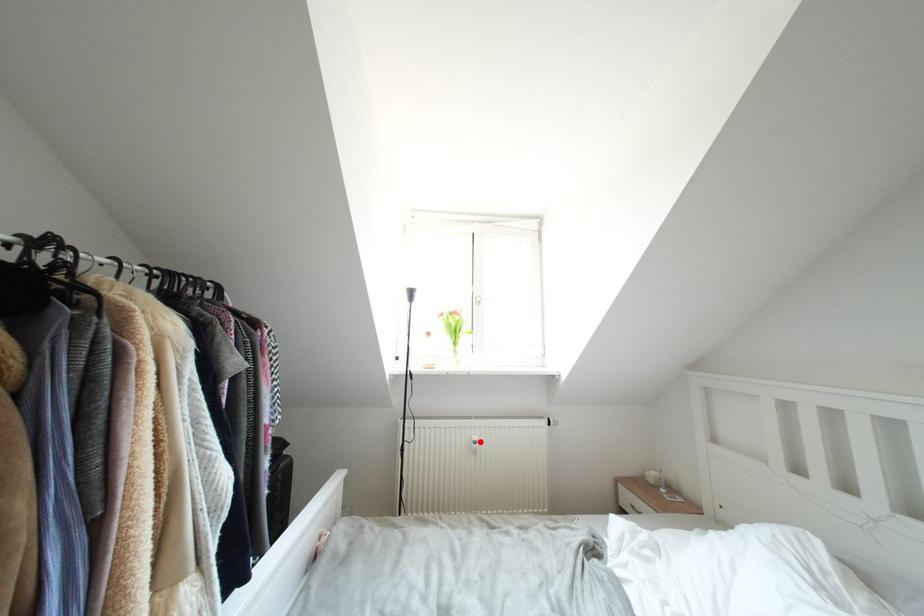
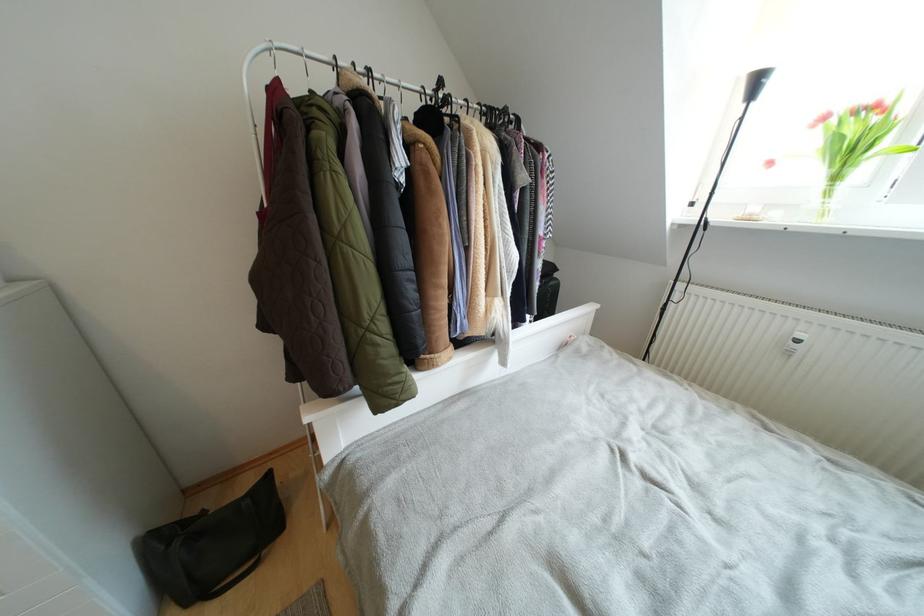
The point at the highlighted location is marked in the first image. Where is the corresponding point in the second image?

(805, 339)